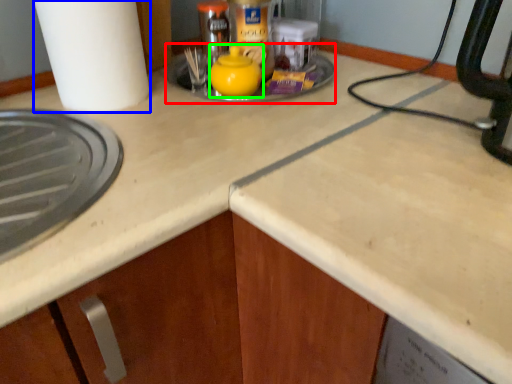
Question: Which object is the farthest from sink (highlighted by a red box)? Choose among these: paper towel (highlighted by a blue box) or tea pot (highlighted by a green box).

Choices:
 (A) paper towel
 (B) tea pot

Answer: (A)